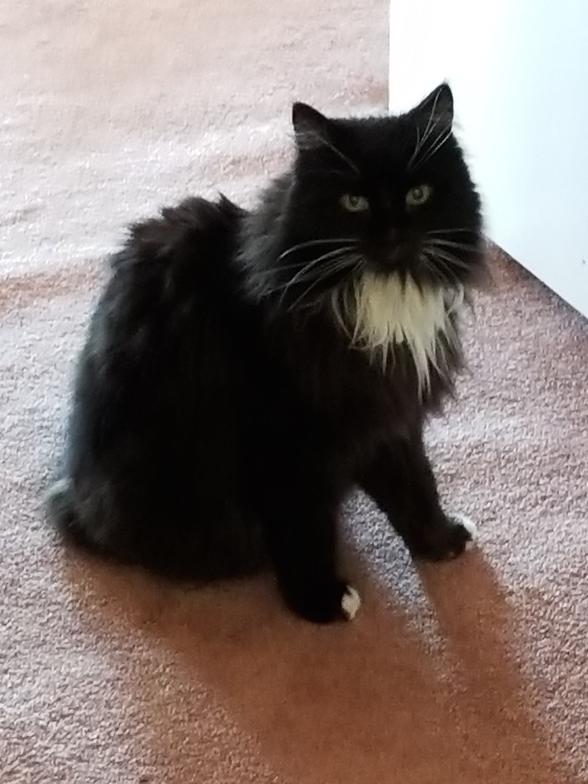
Locate an element on the screen. wrinkles in carpet is located at coordinates (217, 136), (22, 405).